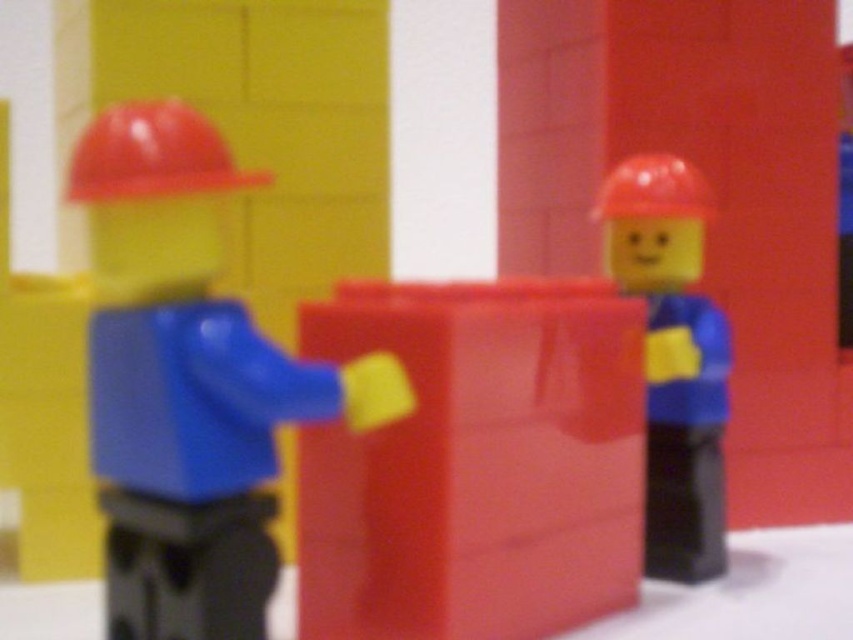
Question: Which is nearer to the matte plastic hard hat at upper left?

Choices:
 (A) matte plastic cube at center
 (B) matte plastic construction worker at left
 (C) matte plastic minifigure at right

Answer: (B)

Question: Is matte plastic construction worker at left above matte plastic hard hat at upper left?

Choices:
 (A) no
 (B) yes

Answer: (A)

Question: From the image, what is the correct spatial relationship of matte plastic cube at center in relation to matte plastic hat at center?

Choices:
 (A) above
 (B) below

Answer: (B)

Question: Which of the following is the closest to the observer?

Choices:
 (A) (177, 150)
 (B) (206, 508)

Answer: (A)

Question: Does matte plastic minifigure at right appear on the right side of matte plastic hat at center?

Choices:
 (A) yes
 (B) no

Answer: (A)

Question: Which object is closer to the camera taking this photo?

Choices:
 (A) matte plastic cube at center
 (B) matte plastic hard hat at upper left
 (C) matte plastic minifigure at right
 (D) matte plastic construction worker at left

Answer: (B)